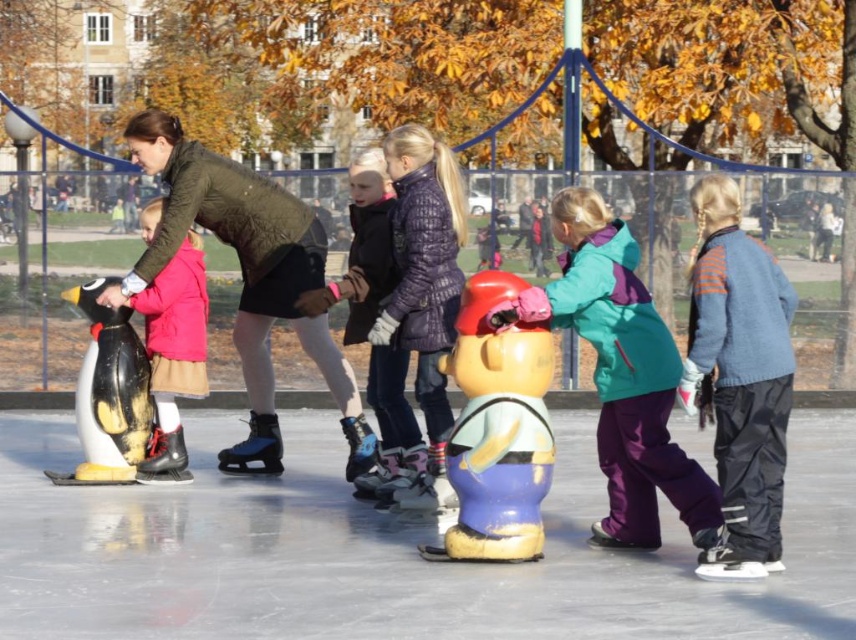
Based on the photo, A child wearing a matte purple jacket at center is trying to reach a matte black penguin at left to give it a hug. The child can stretch their arms 1 meter. Can they reach the penguin?

The distance between the matte purple jacket at center and the matte black penguin at left is 1.09 meters. Since the child can only stretch their arms 1 meter, they cannot reach the penguin.

You are a parent at the ice rink and want to choose a toy for your child to hold onto while skating. The blue rubber figure at center and the matte plastic toy at center are available. Which one is shorter and easier to grip for a small child?

The blue rubber figure at center is shorter than the matte plastic toy at center, making it easier for a small child to grip.